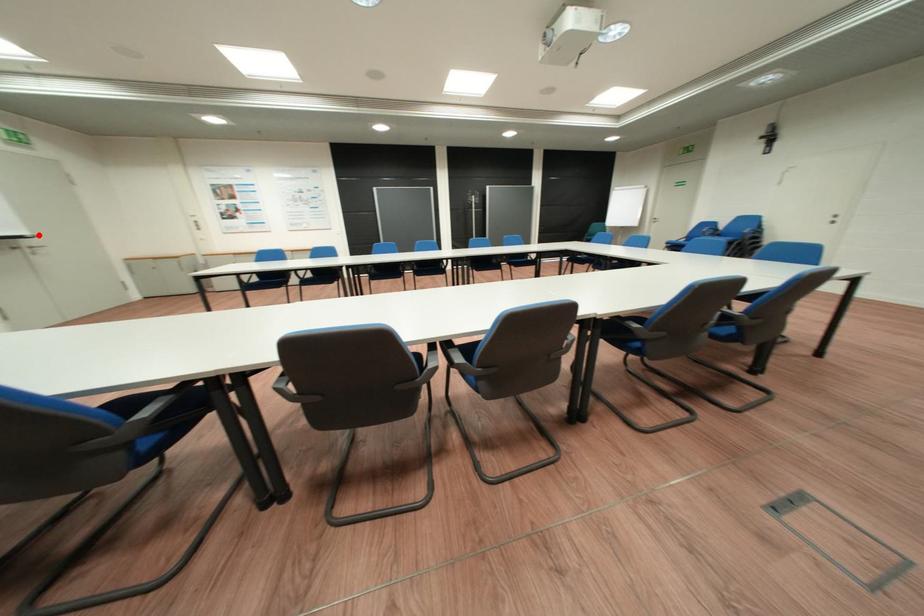
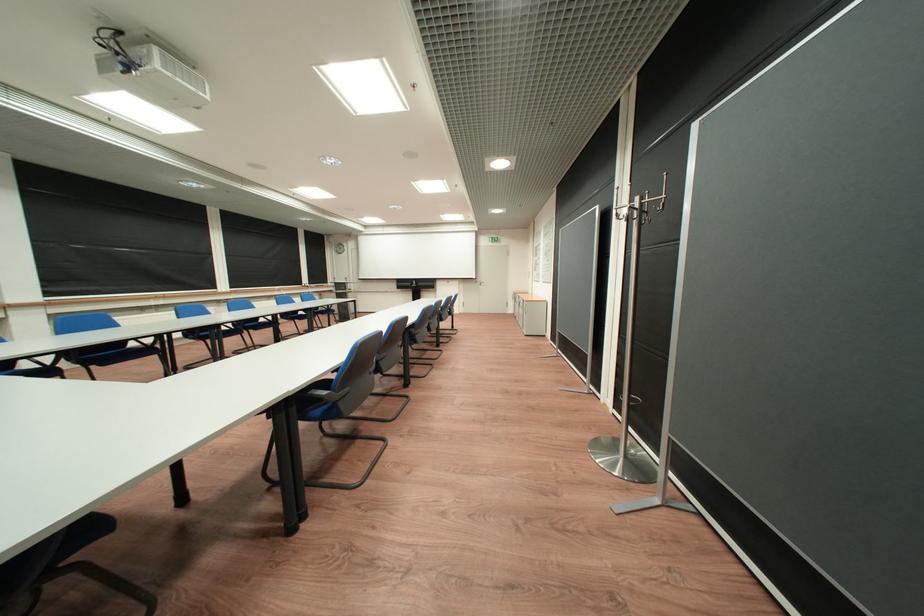
Question: I am providing you with two images of the same scene from different viewpoints. Image1 has a red point marked. In image2, the corresponding 3D location appears at what relative position? Reply with the corresponding letter.

Choices:
 (A) Closer
 (B) Farther

Answer: (A)